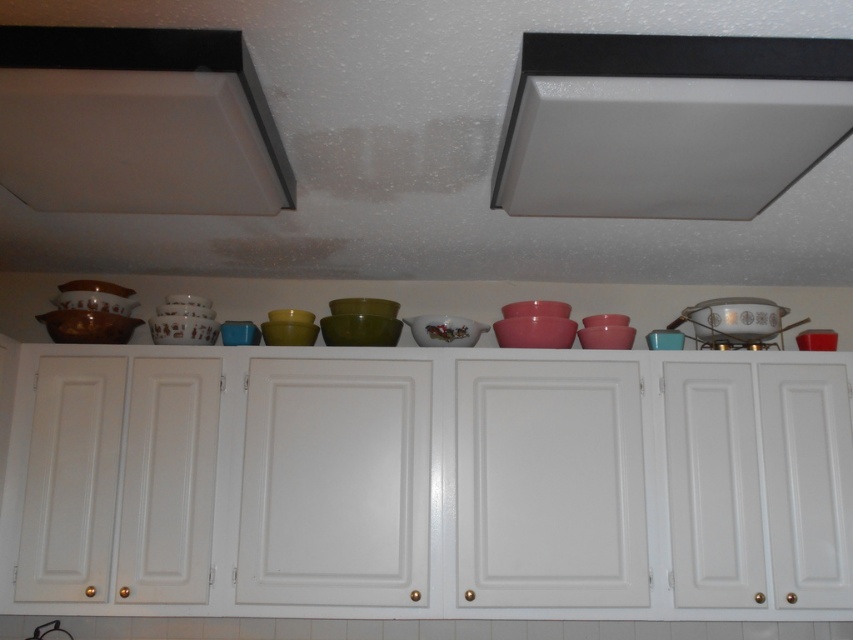
Question: Where is white matte exhaust hood at upper center located in relation to matte white exhaust hood at upper left in the image?

Choices:
 (A) right
 (B) left

Answer: (A)

Question: Among these points, which one is nearest to the camera?

Choices:
 (A) (260, 179)
 (B) (611, 184)

Answer: (A)

Question: Can you confirm if white matte exhaust hood at upper center is positioned above matte white exhaust hood at upper left?

Choices:
 (A) yes
 (B) no

Answer: (A)

Question: Which point is farther to the camera?

Choices:
 (A) (689, 154)
 (B) (181, 154)

Answer: (B)

Question: Is white matte exhaust hood at upper center below matte white exhaust hood at upper left?

Choices:
 (A) yes
 (B) no

Answer: (B)